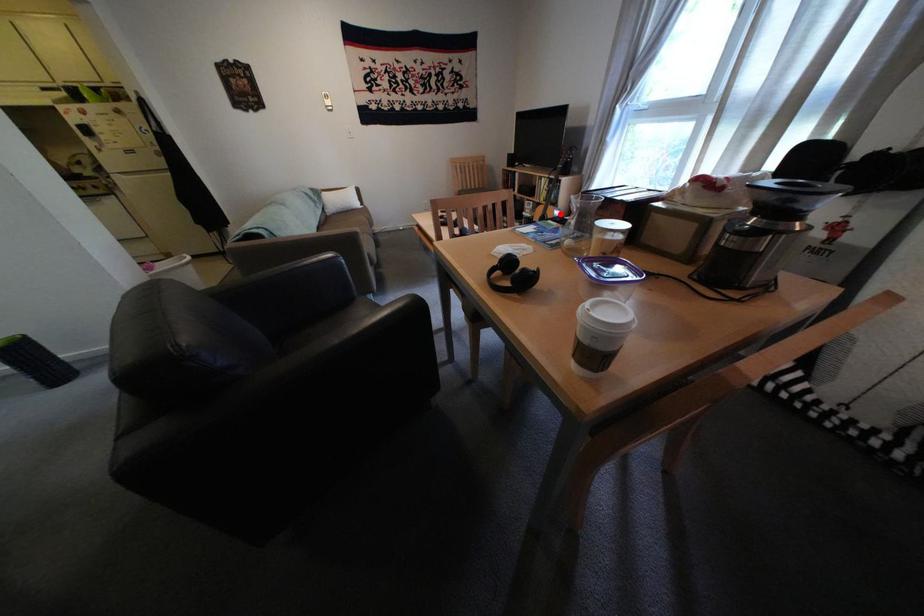
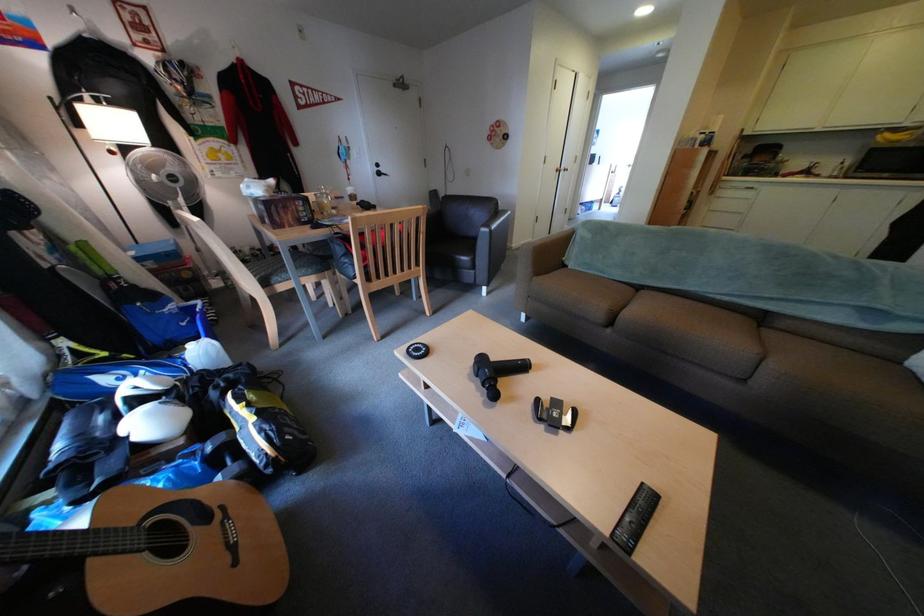
Question: A red point is marked in image1. In image2, is the corresponding 3D point closer to the camera or farther? Reply with the corresponding letter.

Choices:
 (A) The corresponding 3D point is closer.
 (B) The corresponding 3D point is farther.

Answer: (A)